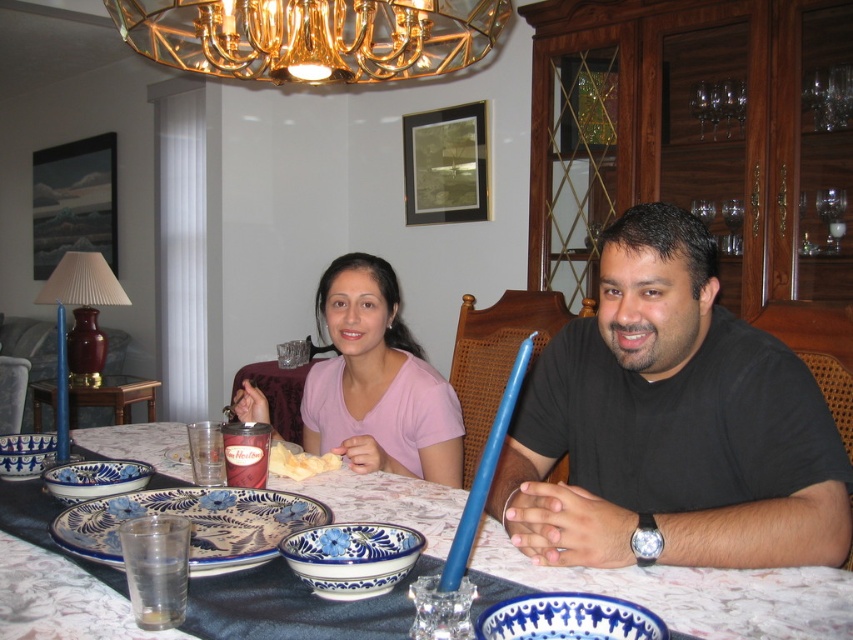
You are a guest at this dining table and want to place your napkin on the blue painted earthenware platter at center. Where exactly should you place it?

The blue painted earthenware platter at center is located at the coordinates point (x=193, y=524), so you should place your napkin there.

You are a server who needs to place a new dish on the table. The dish is 12 inches wide. Can you fit it on the blue painted earthenware platter at center or the clear glass water at lower left?

The blue painted earthenware platter at center has a greater width than the clear glass water at lower left. Since the platter is wider, the 12 inch dish can fit on the blue painted earthenware platter at center but not on the narrower clear glass water at lower left.